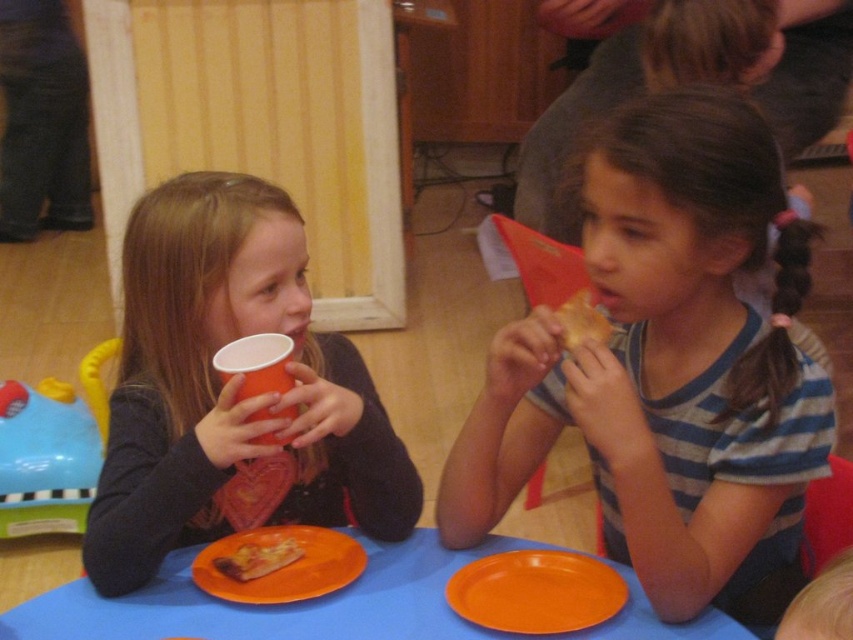
Question: Which object is positioned closest to the matte plastic cup at left?

Choices:
 (A) orange plastic plate at lower center
 (B) orange paper cup at upper left
 (C) golden crispy pizza slice at lower center

Answer: (B)

Question: Observing the image, what is the correct spatial positioning of striped cotton shirt at center in reference to orange plastic plate at lower center?

Choices:
 (A) right
 (B) left

Answer: (A)

Question: Is orange matte plate at lower center closer to the viewer compared to orange plastic plate at lower center?

Choices:
 (A) yes
 (B) no

Answer: (A)

Question: From the image, what is the correct spatial relationship of orange matte plate at lower center in relation to orange paper cup at upper left?

Choices:
 (A) left
 (B) right

Answer: (B)

Question: Which of these objects is positioned farthest from the blue paper table at center?

Choices:
 (A) golden crispy pizza at upper right
 (B) golden crispy pizza slice at lower center

Answer: (A)

Question: Among these objects, which one is farthest from the camera?

Choices:
 (A) golden crispy pizza at upper right
 (B) matte plastic cup at left

Answer: (A)